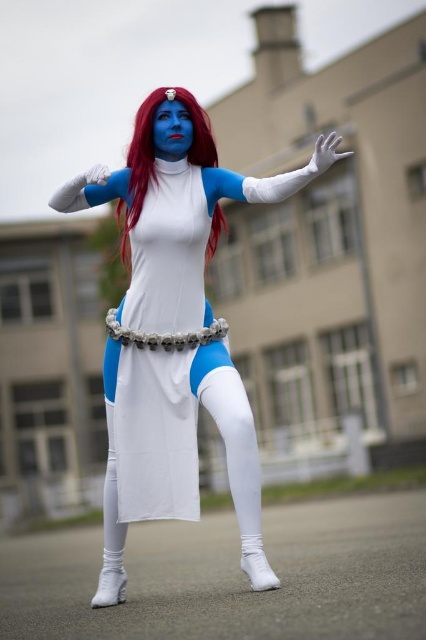
Is matte white glove at upper center to the right of gray metallic belt at center from the viewer's perspective?

Incorrect, matte white glove at upper center is not on the right side of gray metallic belt at center.

Between matte white glove at upper center and gray metallic belt at center, which one is positioned lower?

gray metallic belt at center is below.

Which is behind, point (51, 204) or point (161, 340)?

The point (51, 204) is behind.

Identify the location of matte white glove at upper center. This screenshot has width=426, height=640. (92, 189).

Does matte white costume at center have a greater width compared to shiny red hair at center?

In fact, matte white costume at center might be narrower than shiny red hair at center.

Who is higher up, matte white costume at center or shiny red hair at center?

shiny red hair at center

In order to click on matte white costume at center in this screenshot , I will do `click(173, 451)`.

The width and height of the screenshot is (426, 640). I want to click on matte white costume at center, so click(173, 451).

Can you confirm if shiny red hair at center is taller than gray metallic belt at center?

Correct, shiny red hair at center is much taller as gray metallic belt at center.

Does shiny red hair at center have a smaller size compared to gray metallic belt at center?

No.

Is point (190, 148) positioned in front of point (167, 344)?

No, (190, 148) is further to viewer.

Image resolution: width=426 pixels, height=640 pixels. In order to click on shiny red hair at center in this screenshot , I will do `click(154, 148)`.